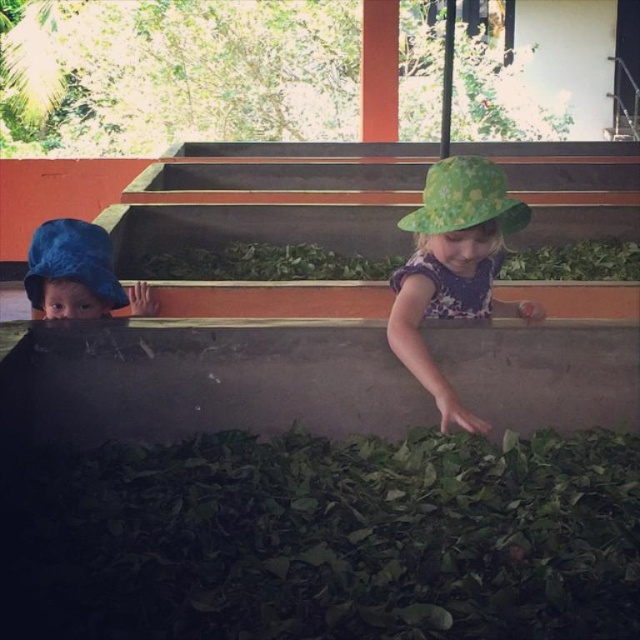
Question: Which of these objects is positioned closest to the green floral hat at center?

Choices:
 (A) blue fabric hat at left
 (B) green fabric hat at upper right

Answer: (B)

Question: Which object is closer to the camera taking this photo?

Choices:
 (A) blue fabric hat at left
 (B) green floral hat at center

Answer: (B)

Question: Can you confirm if green floral hat at center is positioned above green fabric hat at upper right?

Choices:
 (A) yes
 (B) no

Answer: (B)

Question: Which point is farther from the camera taking this photo?

Choices:
 (A) (100, 253)
 (B) (506, 212)
 (C) (476, 252)

Answer: (A)

Question: Does green floral hat at center have a lesser width compared to green fabric hat at upper right?

Choices:
 (A) yes
 (B) no

Answer: (B)

Question: Can you confirm if green floral hat at center is bigger than blue fabric hat at left?

Choices:
 (A) no
 (B) yes

Answer: (B)